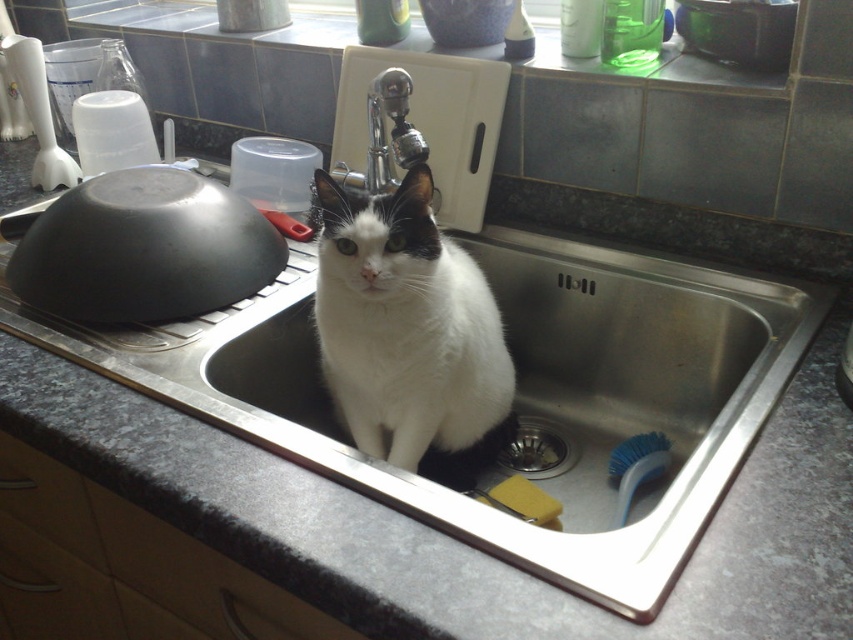
Does white fur cat at sink come in front of brushed metal sink at lower center?

Yes, it is in front of brushed metal sink at lower center.

Measure the distance between point (390, 348) and camera.

Point (390, 348) and camera are 79.90 centimeters apart.

Locate an element on the screen. white fur cat at sink is located at coordinates (407, 328).

Where is `white fur cat at sink`? The width and height of the screenshot is (853, 640). white fur cat at sink is located at coordinates (407, 328).

Who is higher up, matte black bowl at left or brushed metal sink at lower center?

matte black bowl at left is above.

I want to click on matte black bowl at left, so click(144, 248).

Does point (165, 211) come farther from viewer compared to point (563, 467)?

That is False.

Identify the location of matte black bowl at left. Image resolution: width=853 pixels, height=640 pixels. (144, 248).

Who is more distant from viewer, (422, 292) or (41, 275)?

The point (41, 275) is behind.

Who is taller, white fur cat at sink or matte black bowl at left?

white fur cat at sink is taller.

Is point (386, 285) positioned after point (151, 248)?

No, (386, 285) is closer to viewer.

Where is `white fur cat at sink`? The width and height of the screenshot is (853, 640). white fur cat at sink is located at coordinates (407, 328).